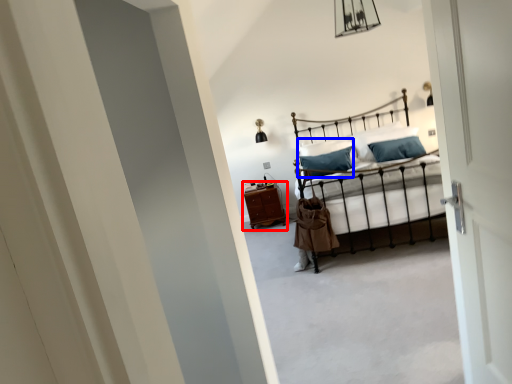
Question: Among these objects, which one is nearest to the camera, nightstand (highlighted by a red box) or pillow (highlighted by a blue box)?

Choices:
 (A) nightstand
 (B) pillow

Answer: (B)